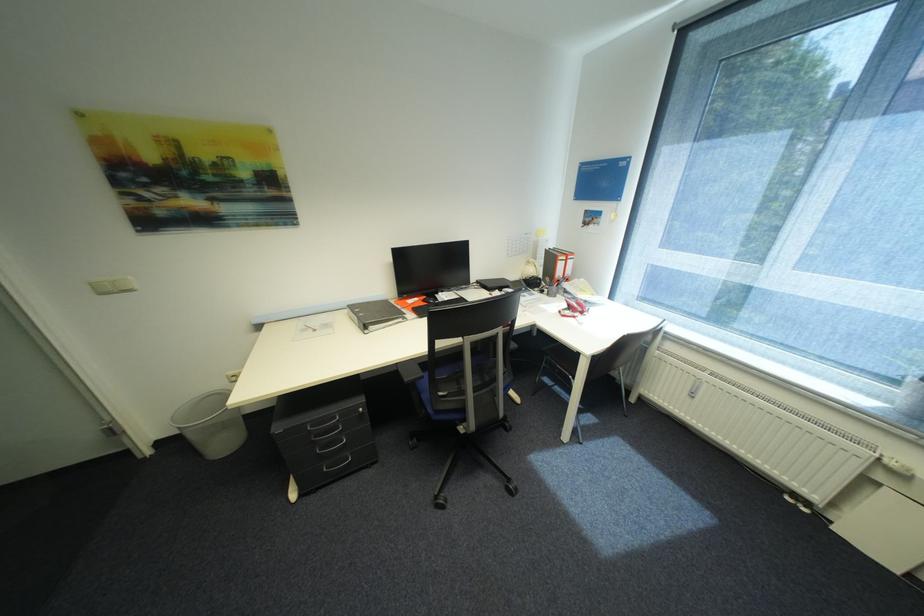
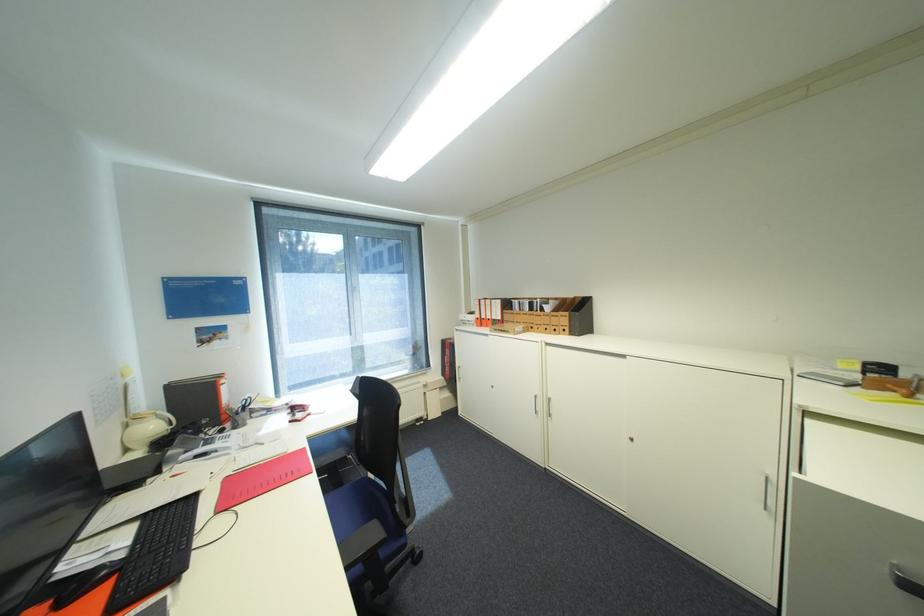
Where in the second image is the point corresponding to [540,270] from the first image?

(161, 427)